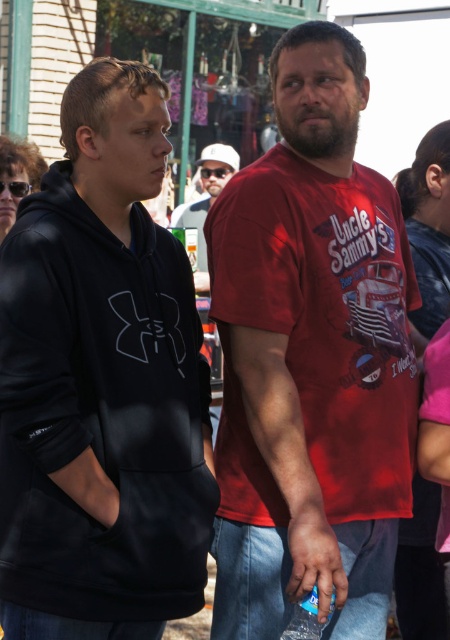
Question: From the image, what is the correct spatial relationship of black fleece hoodie at left in relation to matte white cap at center?

Choices:
 (A) above
 (B) below

Answer: (B)

Question: Does black fleece hoodie at left come in front of matte white cap at center?

Choices:
 (A) yes
 (B) no

Answer: (A)

Question: Estimate the real-world distances between objects in this image. Which object is closer to the matte white cap at center?

Choices:
 (A) black fleece hoodie at left
 (B) red cotton t-shirt at center

Answer: (B)

Question: Which object is farther from the camera taking this photo?

Choices:
 (A) black fleece hoodie at left
 (B) red cotton t-shirt at center
 (C) matte white cap at center

Answer: (C)

Question: Does black fleece hoodie at left appear under matte white cap at center?

Choices:
 (A) yes
 (B) no

Answer: (A)

Question: Which object is closer to the camera taking this photo?

Choices:
 (A) matte white cap at center
 (B) black fleece hoodie at left
 (C) red cotton t-shirt at center

Answer: (B)